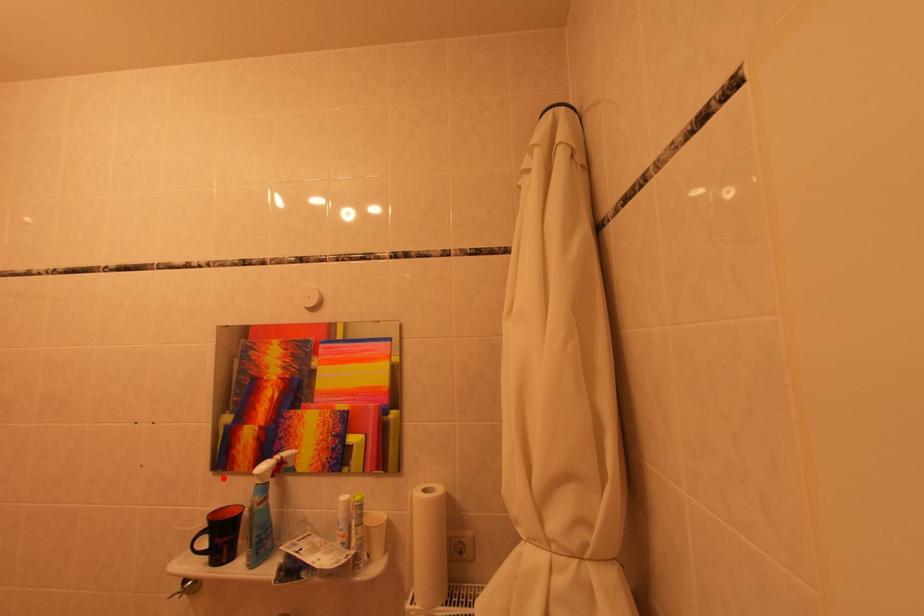
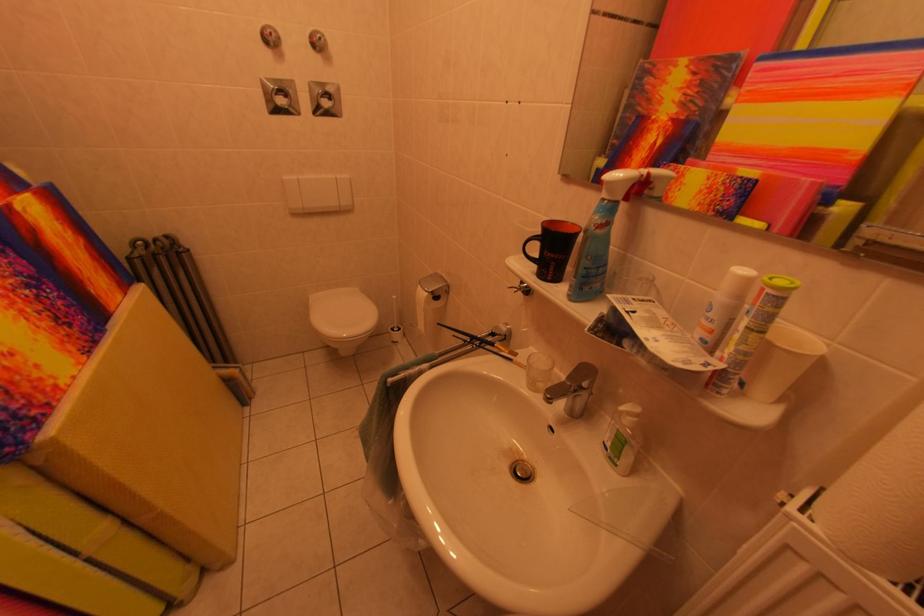
Locate, in the second image, the point that corresponds to the highlighted location in the first image.

(569, 184)